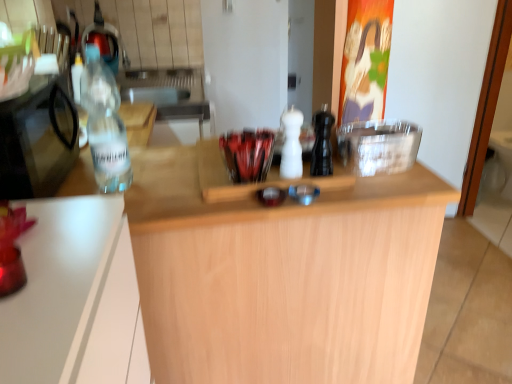
Question: From the image's perspective, does clear glass bottle at left, the 3th bottle positioned from the right, appear lower than transparent plastic bottle at left, the second appliance viewed from the right?

Choices:
 (A) no
 (B) yes

Answer: (A)

Question: From a real-world perspective, is clear glass bottle at left, the 3th bottle positioned from the right, positioned under transparent plastic bottle at left, the first appliance from the left, based on gravity?

Choices:
 (A) no
 (B) yes

Answer: (A)

Question: From a real-world perspective, is clear glass bottle at left, the 3th bottle positioned from the right, physically above transparent plastic bottle at left, the first appliance from the left?

Choices:
 (A) yes
 (B) no

Answer: (A)

Question: Is clear glass bottle at left, the first bottle in the left-to-right sequence, at the left side of transparent plastic bottle at left, the second appliance viewed from the right?

Choices:
 (A) no
 (B) yes

Answer: (A)

Question: Is clear glass bottle at left, the 3th bottle positioned from the right, completely or partially outside of transparent plastic bottle at left, the first appliance from the left?

Choices:
 (A) no
 (B) yes

Answer: (B)

Question: From a real-world perspective, is white matte salt shaker at center, placed as the second bottle when sorted from right to left, physically located above or below black matte pepper grinder at center, arranged as the first bottle when viewed from the right?

Choices:
 (A) above
 (B) below

Answer: (B)

Question: From the image's perspective, relative to black matte pepper grinder at center, marked as the third bottle in a left-to-right arrangement, is white matte salt shaker at center, placed as the second bottle when sorted from right to left, above or below?

Choices:
 (A) above
 (B) below

Answer: (A)

Question: Looking at their shapes, would you say white matte salt shaker at center, which is the 2th bottle in left-to-right order, is wider or thinner than black matte pepper grinder at center, arranged as the first bottle when viewed from the right?

Choices:
 (A) thin
 (B) wide

Answer: (A)

Question: From their relative heights in the image, would you say white matte salt shaker at center, placed as the second bottle when sorted from right to left, is taller or shorter than black matte pepper grinder at center, marked as the third bottle in a left-to-right arrangement?

Choices:
 (A) short
 (B) tall

Answer: (B)

Question: Is transparent plastic bottle at left, the first appliance from the left, bigger or smaller than light wood countertop at center?

Choices:
 (A) big
 (B) small

Answer: (B)

Question: Is transparent plastic bottle at left, the second appliance viewed from the right, taller or shorter than light wood countertop at center?

Choices:
 (A) tall
 (B) short

Answer: (B)

Question: From a real-world perspective, is transparent plastic bottle at left, the first appliance from the left, positioned above or below light wood countertop at center?

Choices:
 (A) above
 (B) below

Answer: (A)

Question: Is transparent plastic bottle at left, the first appliance from the left, inside the boundaries of light wood countertop at center, or outside?

Choices:
 (A) inside
 (B) outside

Answer: (B)

Question: Considering their positions, is transparent plastic bottle at left, the second appliance viewed from the right, located in front of or behind white matte salt shaker at center, placed as the second bottle when sorted from right to left?

Choices:
 (A) front
 (B) behind

Answer: (A)

Question: From the image's perspective, relative to white matte salt shaker at center, which is the 2th bottle in left-to-right order, is transparent plastic bottle at left, the second appliance viewed from the right, above or below?

Choices:
 (A) above
 (B) below

Answer: (B)